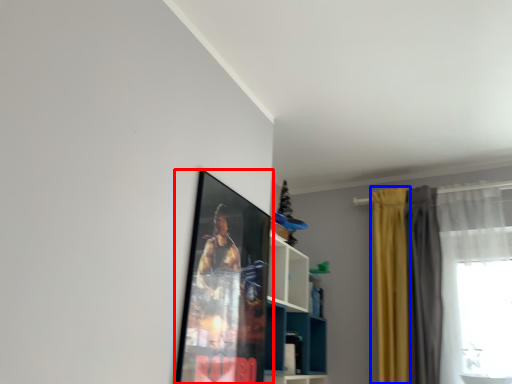
Question: Which point is closer to the camera, picture frame (highlighted by a red box) or curtain (highlighted by a blue box)?

Choices:
 (A) picture frame
 (B) curtain

Answer: (A)